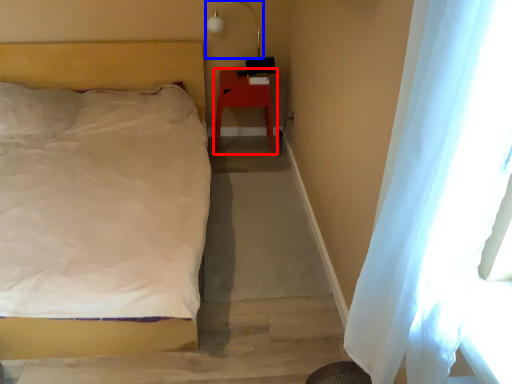
Question: Which point is closer to the camera, furniture (highlighted by a red box) or lamp (highlighted by a blue box)?

Choices:
 (A) furniture
 (B) lamp

Answer: (B)